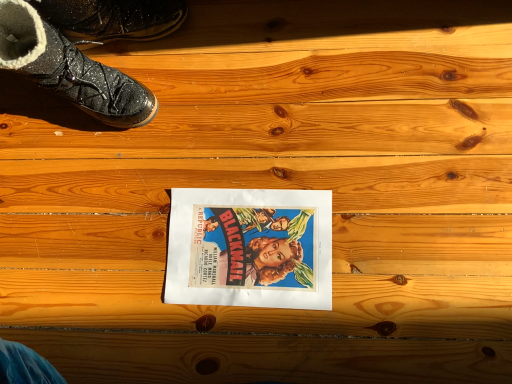
Question: Considering the relative sizes of matte paper movie poster at center and sparkly black boot at upper left, placed as the 2th footwear when sorted from bottom to top, in the image provided, is matte paper movie poster at center bigger than sparkly black boot at upper left, placed as the 2th footwear when sorted from bottom to top,?

Choices:
 (A) no
 (B) yes

Answer: (A)

Question: From the image's perspective, is matte paper movie poster at center beneath sparkly black boot at upper left, which is the 1th footwear from top to bottom?

Choices:
 (A) yes
 (B) no

Answer: (A)

Question: Can you confirm if matte paper movie poster at center is positioned to the right of sparkly black boot at upper left, placed as the 2th footwear when sorted from bottom to top?

Choices:
 (A) yes
 (B) no

Answer: (A)

Question: From a real-world perspective, does matte paper movie poster at center sit lower than sparkly black boot at upper left, which is the 1th footwear from top to bottom?

Choices:
 (A) yes
 (B) no

Answer: (A)

Question: Is matte paper movie poster at center shorter than sparkly black boot at upper left, which is the 1th footwear from top to bottom?

Choices:
 (A) no
 (B) yes

Answer: (B)

Question: Is shiny black boot at upper left, the first footwear in the bottom-to-top sequence, taller or shorter than matte paper movie poster at center?

Choices:
 (A) tall
 (B) short

Answer: (A)

Question: Visually, is shiny black boot at upper left, which is the 2th footwear from top to bottom, positioned to the left or to the right of matte paper movie poster at center?

Choices:
 (A) left
 (B) right

Answer: (A)

Question: Relative to matte paper movie poster at center, is shiny black boot at upper left, which is the 2th footwear from top to bottom, in front or behind?

Choices:
 (A) front
 (B) behind

Answer: (A)

Question: Does point (20, 57) appear closer or farther from the camera than point (242, 291)?

Choices:
 (A) farther
 (B) closer

Answer: (B)

Question: Is sparkly black boot at upper left, which is the 1th footwear from top to bottom, in front of or behind shiny black boot at upper left, the first footwear in the bottom-to-top sequence, in the image?

Choices:
 (A) behind
 (B) front

Answer: (A)

Question: Would you say sparkly black boot at upper left, which is the 1th footwear from top to bottom, is inside or outside shiny black boot at upper left, which is the 2th footwear from top to bottom?

Choices:
 (A) inside
 (B) outside

Answer: (B)

Question: From a real-world perspective, relative to shiny black boot at upper left, which is the 2th footwear from top to bottom, is sparkly black boot at upper left, placed as the 2th footwear when sorted from bottom to top, vertically above or below?

Choices:
 (A) above
 (B) below

Answer: (B)

Question: Is sparkly black boot at upper left, placed as the 2th footwear when sorted from bottom to top, taller or shorter than shiny black boot at upper left, the first footwear in the bottom-to-top sequence?

Choices:
 (A) short
 (B) tall

Answer: (A)

Question: Considering the positions of shiny black boot at upper left, which is the 2th footwear from top to bottom, and sparkly black boot at upper left, placed as the 2th footwear when sorted from bottom to top, in the image, is shiny black boot at upper left, which is the 2th footwear from top to bottom, wider or thinner than sparkly black boot at upper left, placed as the 2th footwear when sorted from bottom to top,?

Choices:
 (A) wide
 (B) thin

Answer: (A)

Question: In terms of height, does shiny black boot at upper left, the first footwear in the bottom-to-top sequence, look taller or shorter compared to sparkly black boot at upper left, placed as the 2th footwear when sorted from bottom to top?

Choices:
 (A) tall
 (B) short

Answer: (A)